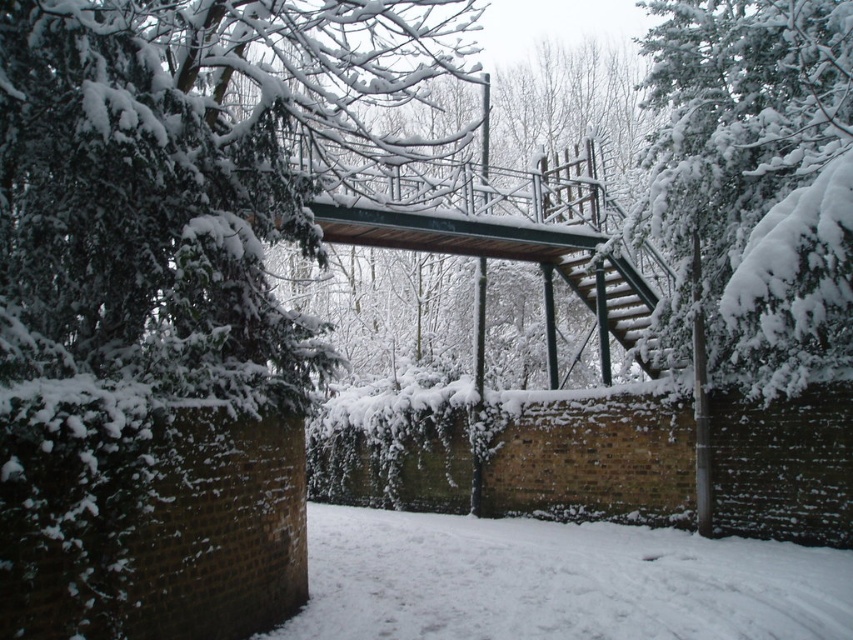
You are a delivery robot with a 1 meter wide package. You need to navigate through the snow to reach the platform. Can you pass through the area between the white powdery snow at lower center and the metallic green staircase at center right?

The white powdery snow at lower center has a width less than the metallic green staircase at center right. Since your package is 1 meter wide, you need to check the minimum width between them. If the narrowest point is at least 1 meter, you can pass. However, since the snow is narrower than the staircase, the available space might be insufficient. Without exact measurements, it is uncertain, but the description suggests the snow is narrower, so the path might be too narrow for the package.

You are standing at the bottom of the metal staircase with a railing in the snow scene. You want to walk towards the platform at the top left. There is a point marked at coordinates point (558, 580). What is located at that point?

The point (558, 580) corresponds to white powdery snow at lower center.